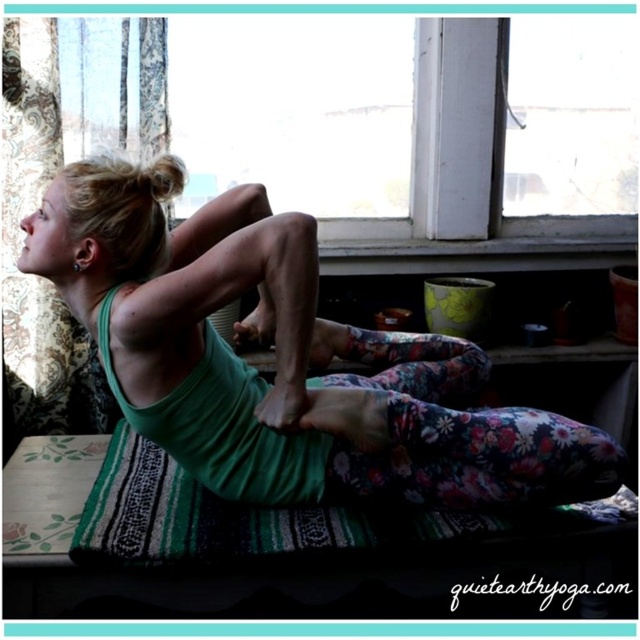
Can you confirm if green fabric yoga mat at center is smaller than green woven yoga mat at lower center?

No, green fabric yoga mat at center is not smaller than green woven yoga mat at lower center.

This screenshot has width=640, height=640. What do you see at coordinates (282, 358) in the screenshot?
I see `green fabric yoga mat at center` at bounding box center [282, 358].

Which is behind, point (256, 449) or point (339, 515)?

The point (339, 515) is more distant.

Identify the location of green fabric yoga mat at center. (282, 358).